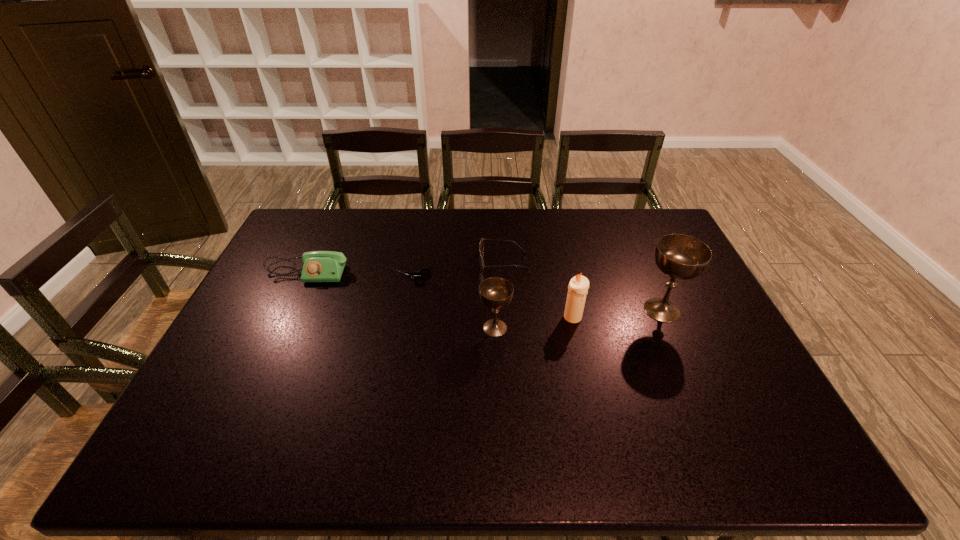
Please point a vacant point for placing a chalice on the left. Please provide its 2D coordinates. Your answer should be formatted as a tuple, i.e. [(x, y)], where the tuple contains the x and y coordinates of a point satisfying the conditions above.

[(313, 347)]